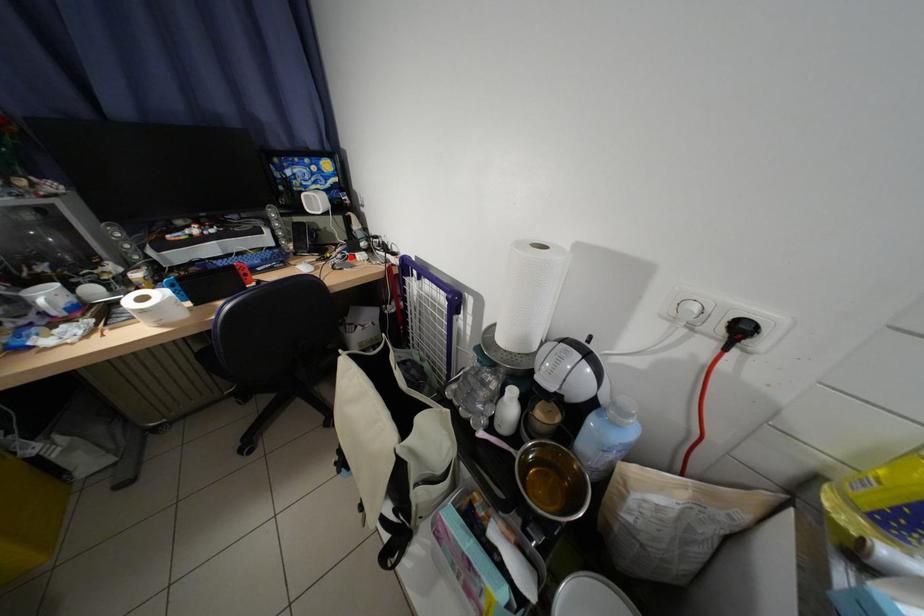
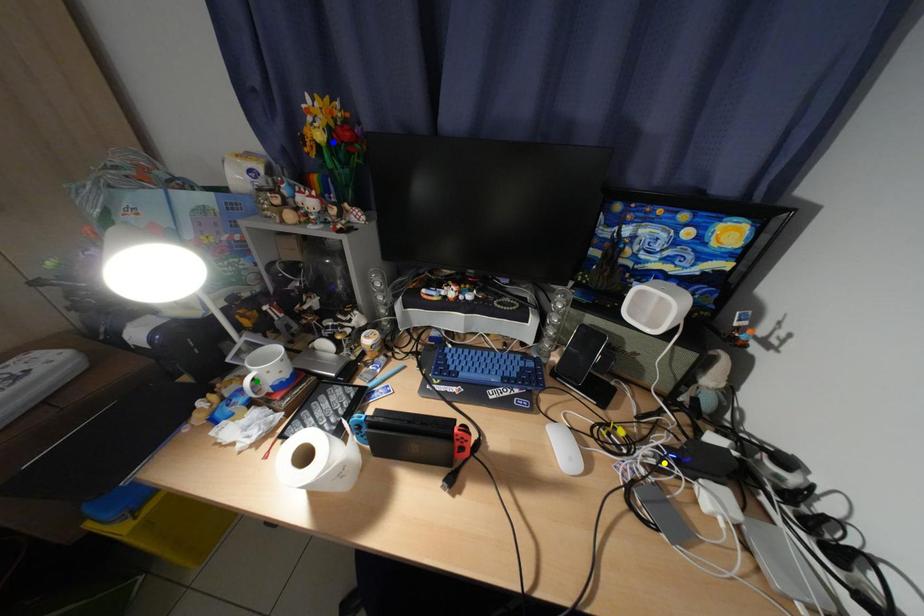
Question: I am providing you with two images of the same scene from different viewpoints. A red point is marked on the first image. You are given multiple points on the second image. Which mark in image 2 goes with the point in image 1?

Choices:
 (A) green point
 (B) blue point
 (C) yellow point

Answer: (C)